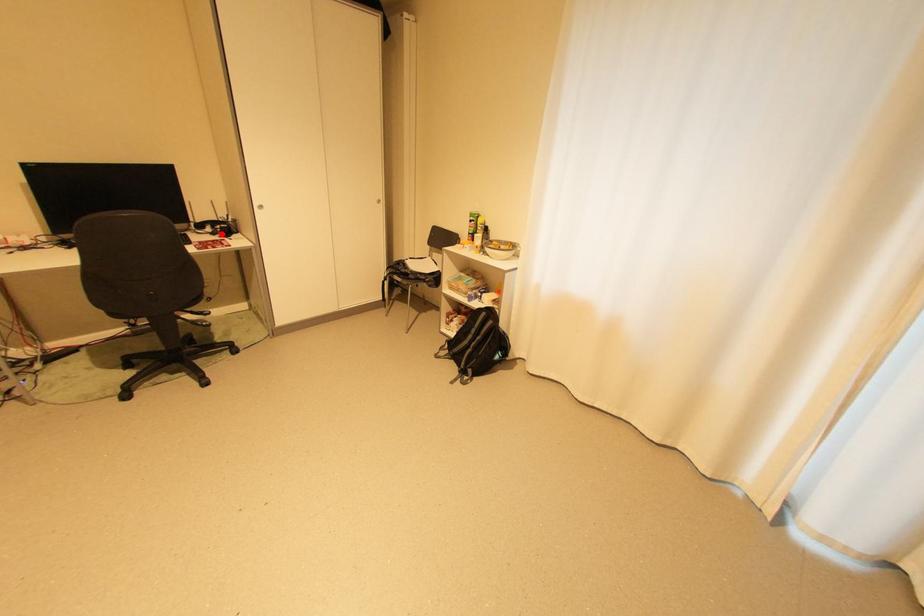
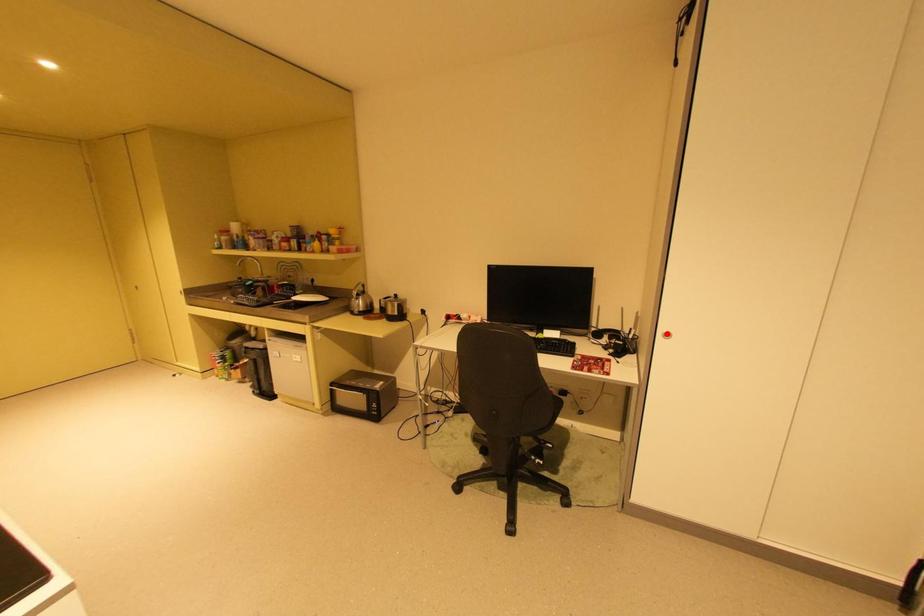
I am providing you with two images of the same scene from different viewpoints. A red point is marked on the first image and another point is marked on the second image. Do the highlighted points in image1 and image2 indicate the same real-world spot?

No